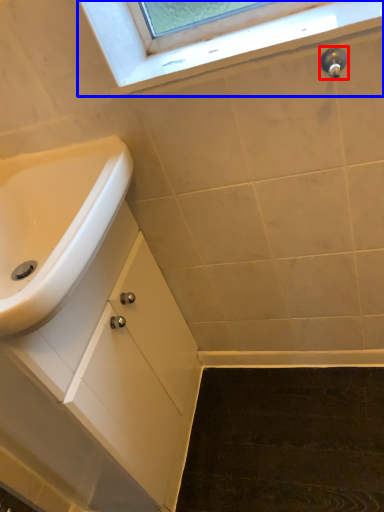
Question: Which point is closer to the camera, plumbing fixture (highlighted by a red box) or window (highlighted by a blue box)?

Choices:
 (A) plumbing fixture
 (B) window

Answer: (B)